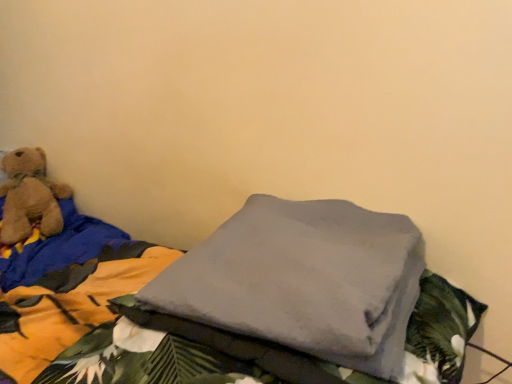
Question: Does soft brown teddy bear at left have a lesser width compared to gray fleece blanket at center?

Choices:
 (A) no
 (B) yes

Answer: (B)

Question: From the image's perspective, is soft brown teddy bear at left on gray fleece blanket at center?

Choices:
 (A) no
 (B) yes

Answer: (B)

Question: Does soft brown teddy bear at left come in front of gray fleece blanket at center?

Choices:
 (A) no
 (B) yes

Answer: (A)

Question: Considering the relative sizes of soft brown teddy bear at left and gray fleece blanket at center in the image provided, is soft brown teddy bear at left shorter than gray fleece blanket at center?

Choices:
 (A) no
 (B) yes

Answer: (A)

Question: Is soft brown teddy bear at left with gray fleece blanket at center?

Choices:
 (A) no
 (B) yes

Answer: (A)

Question: Is soft brown teddy bear at left oriented towards gray fleece blanket at center?

Choices:
 (A) no
 (B) yes

Answer: (A)

Question: Could soft brown teddy bear at left be considered to be inside gray fleece blanket at center?

Choices:
 (A) yes
 (B) no

Answer: (B)

Question: Can you confirm if gray fleece blanket at center is smaller than soft brown teddy bear at left?

Choices:
 (A) no
 (B) yes

Answer: (B)

Question: Can you confirm if gray fleece blanket at center is thinner than soft brown teddy bear at left?

Choices:
 (A) yes
 (B) no

Answer: (B)

Question: Are gray fleece blanket at center and soft brown teddy bear at left making contact?

Choices:
 (A) no
 (B) yes

Answer: (A)

Question: Is gray fleece blanket at center further to the viewer compared to soft brown teddy bear at left?

Choices:
 (A) no
 (B) yes

Answer: (A)

Question: Can you confirm if gray fleece blanket at center is bigger than soft brown teddy bear at left?

Choices:
 (A) no
 (B) yes

Answer: (A)

Question: In terms of width, does gray fleece blanket at center look wider or thinner when compared to soft brown teddy bear at left?

Choices:
 (A) thin
 (B) wide

Answer: (B)